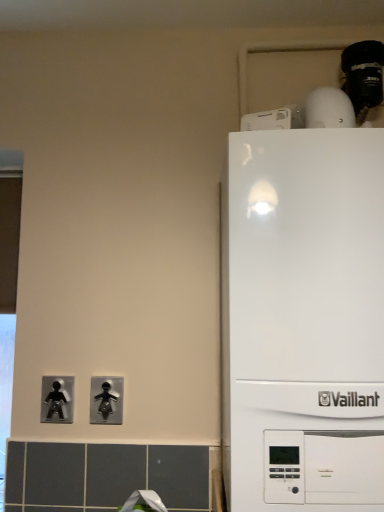
Question: Does black plastic light switch at lower center, which is the first light switch in right-to-left order, appear on the right side of white glossy boiler at right?

Choices:
 (A) yes
 (B) no

Answer: (B)

Question: Can you confirm if black plastic light switch at lower center, the second light switch from the left, is shorter than white glossy boiler at right?

Choices:
 (A) yes
 (B) no

Answer: (A)

Question: Is black plastic light switch at lower center, the second light switch from the left, positioned with its back to white glossy boiler at right?

Choices:
 (A) yes
 (B) no

Answer: (B)

Question: Is black plastic light switch at lower center, the second light switch from the left, closer to the viewer compared to white glossy boiler at right?

Choices:
 (A) no
 (B) yes

Answer: (A)

Question: Is black plastic light switch at lower center, the second light switch from the left, thinner than white glossy boiler at right?

Choices:
 (A) yes
 (B) no

Answer: (A)

Question: From the image's perspective, is white glossy boiler at right above or below metallic silver figure at lower left, which is the 1th light switch in left-to-right order?

Choices:
 (A) above
 (B) below

Answer: (A)

Question: From a real-world perspective, is white glossy boiler at right above or below metallic silver figure at lower left, which is the 1th light switch in left-to-right order?

Choices:
 (A) below
 (B) above

Answer: (B)

Question: In the image, is white glossy boiler at right positioned in front of or behind metallic silver figure at lower left, which is the 1th light switch in left-to-right order?

Choices:
 (A) behind
 (B) front

Answer: (B)

Question: Is white glossy boiler at right inside or outside of metallic silver figure at lower left, which is the 1th light switch in left-to-right order?

Choices:
 (A) outside
 (B) inside

Answer: (A)

Question: Looking at their shapes, would you say black plastic light switch at lower center, which is the first light switch in right-to-left order, is wider or thinner than white glossy boiler at right?

Choices:
 (A) wide
 (B) thin

Answer: (B)

Question: In the image, is black plastic light switch at lower center, which is the first light switch in right-to-left order, on the left side or the right side of white glossy boiler at right?

Choices:
 (A) right
 (B) left

Answer: (B)

Question: Is point (119, 412) positioned closer to the camera than point (283, 336)?

Choices:
 (A) closer
 (B) farther

Answer: (B)

Question: In terms of size, does black plastic light switch at lower center, the second light switch from the left, appear bigger or smaller than white glossy boiler at right?

Choices:
 (A) big
 (B) small

Answer: (B)

Question: From a real-world perspective, relative to metallic silver figure at lower left, arranged as the 2th light switch when viewed from the right, is black plastic light switch at lower center, the second light switch from the left, vertically above or below?

Choices:
 (A) below
 (B) above

Answer: (A)

Question: Considering the relative positions of black plastic light switch at lower center, which is the first light switch in right-to-left order, and metallic silver figure at lower left, arranged as the 2th light switch when viewed from the right, in the image provided, is black plastic light switch at lower center, which is the first light switch in right-to-left order, to the left or to the right of metallic silver figure at lower left, arranged as the 2th light switch when viewed from the right,?

Choices:
 (A) left
 (B) right

Answer: (B)